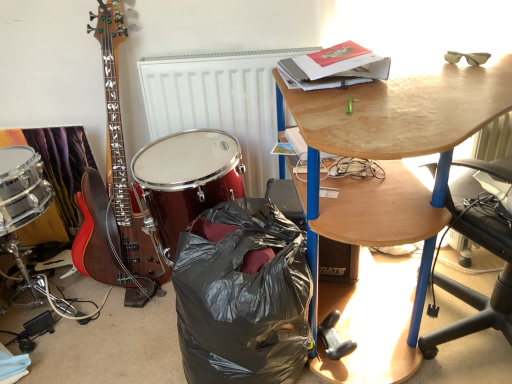
Question: Is shiny red drum at center situated inside black plastic bag at lower center or outside?

Choices:
 (A) inside
 (B) outside

Answer: (B)

Question: In the image, is shiny red drum at center on the left side or the right side of black plastic bag at lower center?

Choices:
 (A) left
 (B) right

Answer: (A)

Question: Based on their relative distances, which object is nearer to the wooden desk at upper right?

Choices:
 (A) black plastic loudspeaker at lower center
 (B) white textured radiator at center
 (C) shiny red drum at center
 (D) black plastic bag at lower center

Answer: (D)

Question: Estimate the real-world distances between objects in this image. Which object is farther from the black plastic loudspeaker at lower center?

Choices:
 (A) wooden desk at upper right
 (B) white textured radiator at center
 (C) black plastic bag at lower center
 (D) shiny red drum at center

Answer: (B)